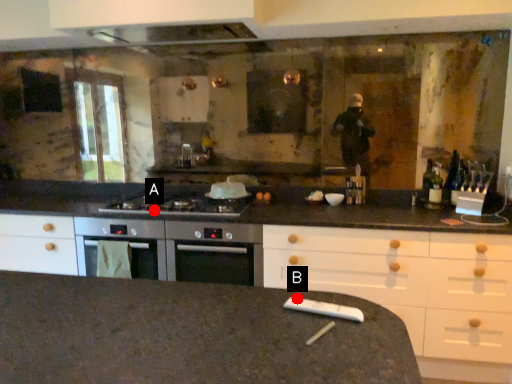
Question: Two points are circled on the image, labeled by A and B beside each circle. Among these points, which one is farthest from the camera?

Choices:
 (A) A is further
 (B) B is further

Answer: (A)